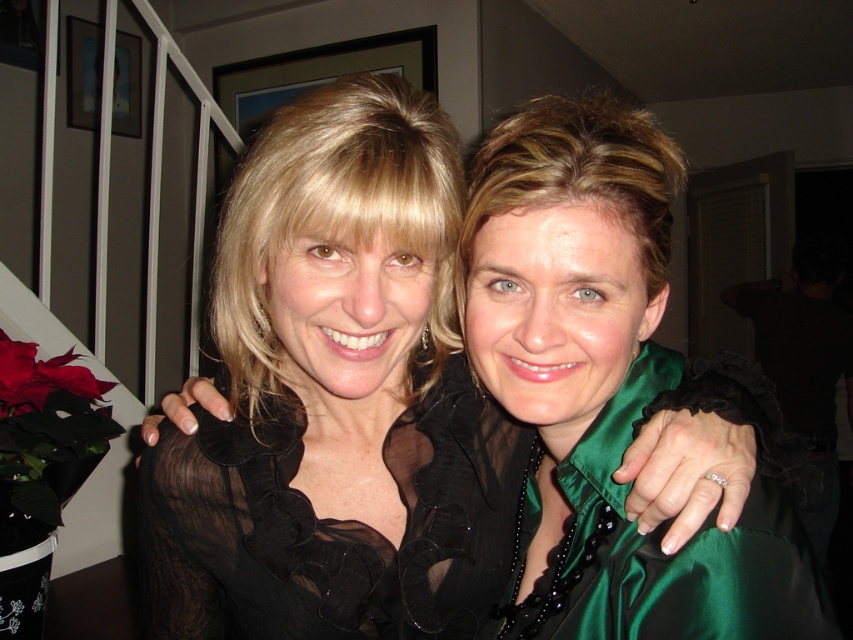
You are a photographer trying to capture a candid shot of both the black sheer blouse at center and the black sheer dress at center. Given that your camera has a minimum focus distance of 1.5 inches, will you be able to focus on both subjects simultaneously without moving closer?

The distance between the black sheer blouse at center and the black sheer dress at center is 1.56 inches, which is slightly more than the camera minimum focus distance of 1.5 inches. Therefore, the camera should be able to focus on both subjects simultaneously without moving closer.

You are a photographer at a social event and need to capture a photo of both the black sheer dress at center and the green satin dress at center. Since you want them to appear side by side in the photo, which dress should be on the left side when framing the shot?

The black sheer dress at center is positioned on the left side of green satin dress at center, so when framing the shot, the black sheer dress at center should be on the left side to match their actual positions.

You are organizing a clothing donation drive and need to determine which of the two items takes up more space in a donation box. Which item between the black sheer blouse at center and the green satin dress at center occupies more space?

The black sheer blouse at center is bigger than the green satin dress at center, so it occupies more space in the donation box.